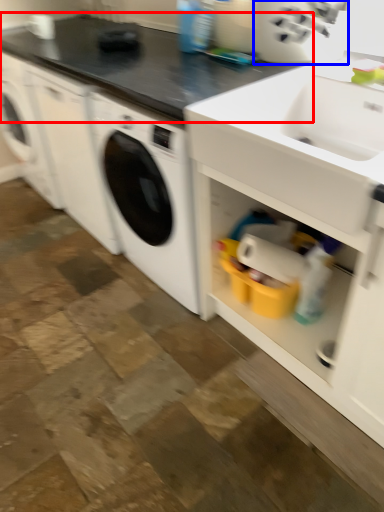
Question: Which of the following is the closest to the observer, countertop (highlighted by a red box) or appliance (highlighted by a blue box)?

Choices:
 (A) countertop
 (B) appliance

Answer: (A)